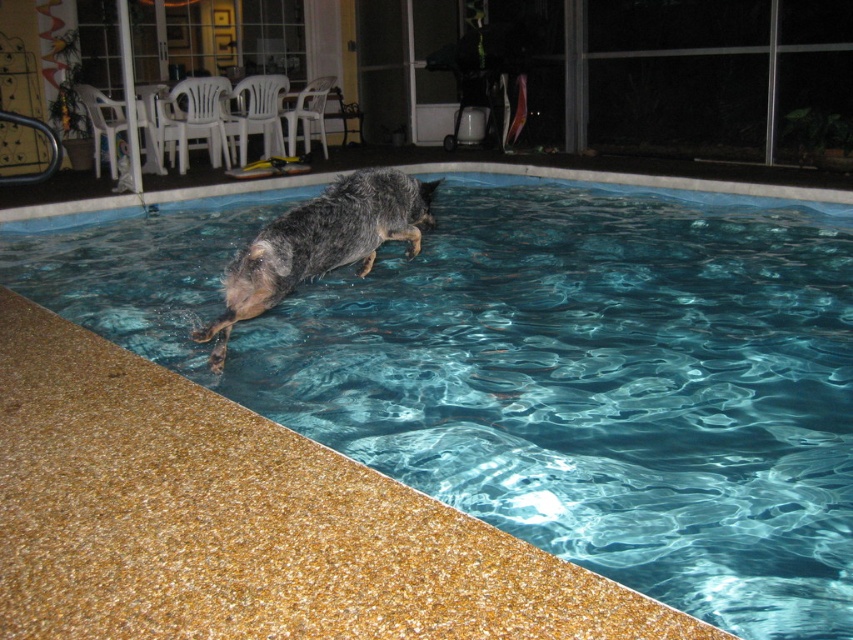
Question: Which point is farther to the camera?

Choices:
 (A) (399, 195)
 (B) (769, 205)

Answer: (B)

Question: Is clear blue water at center smaller than wet fur dog at center?

Choices:
 (A) no
 (B) yes

Answer: (A)

Question: Does clear blue water at center appear over wet fur dog at center?

Choices:
 (A) yes
 (B) no

Answer: (A)

Question: Does clear blue water at center appear on the right side of wet fur dog at center?

Choices:
 (A) yes
 (B) no

Answer: (A)

Question: Among these objects, which one is nearest to the camera?

Choices:
 (A) clear blue water at center
 (B) wet fur dog at center

Answer: (B)

Question: Which point appears farthest from the camera in this image?

Choices:
 (A) (376, 243)
 (B) (813, 234)

Answer: (B)